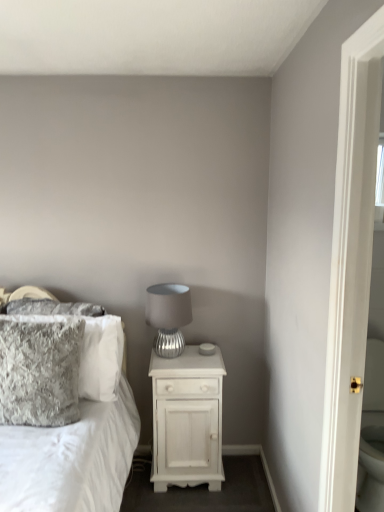
Question: In terms of height, does silver textured lamp at center look taller or shorter compared to white fluffy pillow at left?

Choices:
 (A) short
 (B) tall

Answer: (A)

Question: Looking at their shapes, would you say silver textured lamp at center is wider or thinner than white fluffy pillow at left?

Choices:
 (A) wide
 (B) thin

Answer: (B)

Question: Which object is the closest to the fuzzy gray pillow at left, which is counted as the 1th pillow, starting from the front?

Choices:
 (A) velvety gray pillow at left, the first pillow in the back-to-front sequence
 (B) silver textured lamp at center
 (C) white wood nightstand at center
 (D) white fluffy pillow at left

Answer: (A)

Question: Considering the real-world distances, which object is closest to the white fluffy pillow at left?

Choices:
 (A) white wood nightstand at center
 (B) silver textured lamp at center
 (C) velvety gray pillow at left, the first pillow in the back-to-front sequence
 (D) fuzzy gray pillow at left, which is counted as the 1th pillow, starting from the front

Answer: (C)